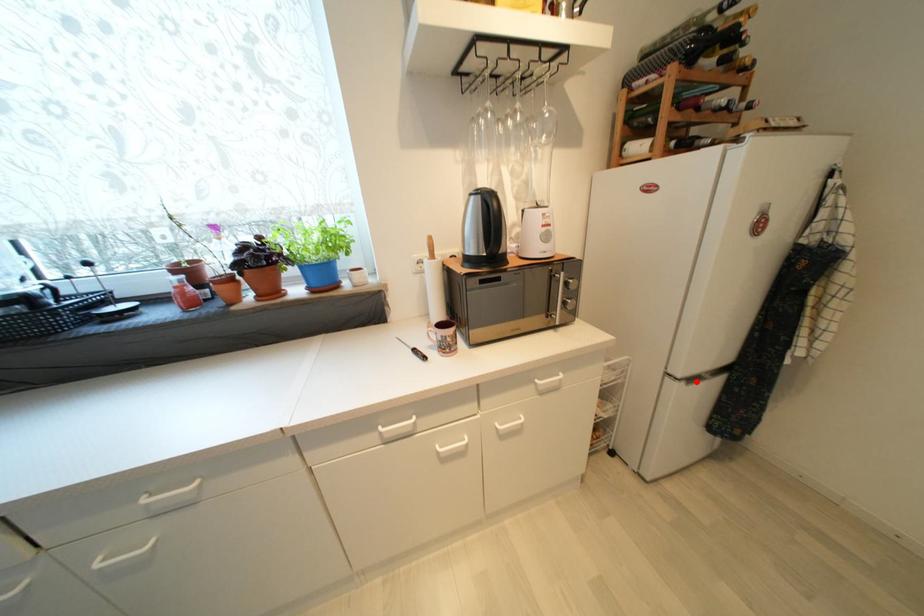
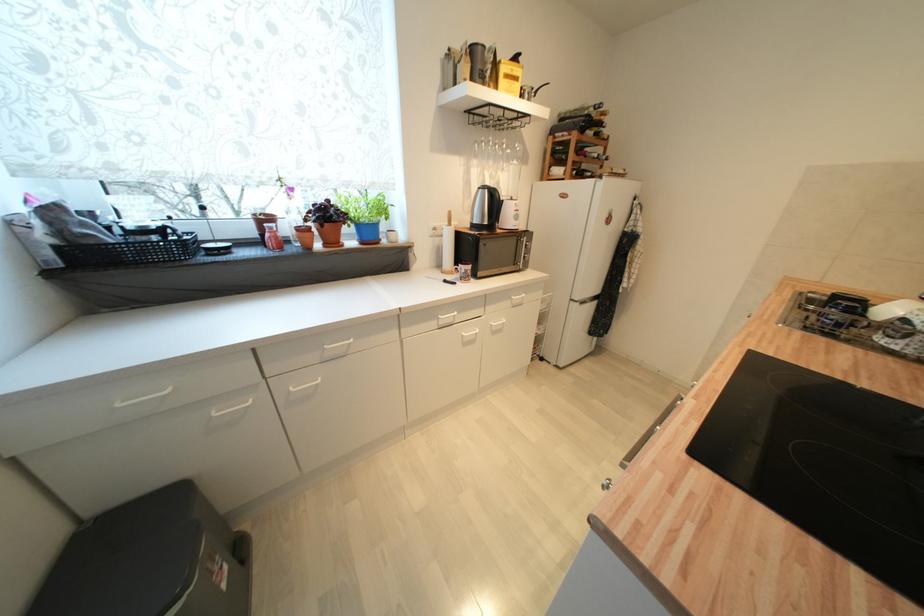
In the second image, find the point that corresponds to the highlighted location in the first image.

(587, 304)